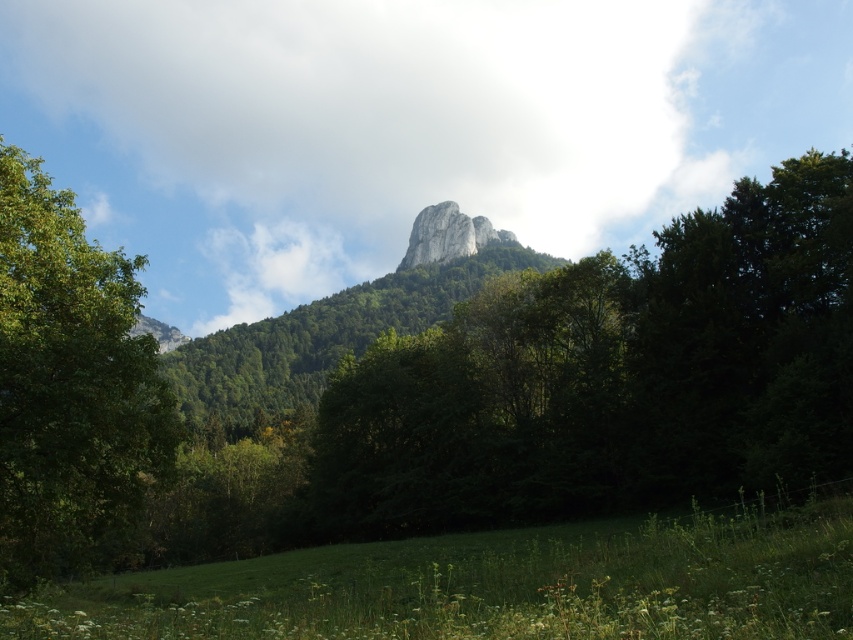
You are standing in the grassy field and want to walk towards the green leafy tree at center. However, there is a green leafy tree at left in your path. Which tree is wider, allowing you to easily walk around it without getting too close?

The green leafy tree at center is wider than the green leafy tree at left, so you can easily walk around it without getting too close.

You are an environmental scientist studying the landscape. You observe the green leafy tree at center and the white rock formation at center. Which object is taller in the scene?

The white rock formation at center is taller than the green leafy tree at center.